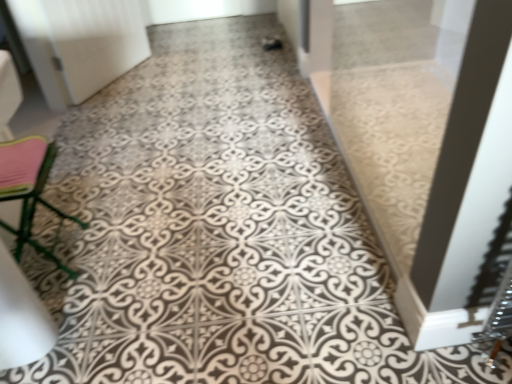
I want to click on metallic green stool at left, so click(29, 189).

This screenshot has height=384, width=512. Describe the element at coordinates (29, 189) in the screenshot. I see `metallic green stool at left` at that location.

What is the approximate height of metallic green stool at left?

The height of metallic green stool at left is 41.35 centimeters.

Measure the distance between point (32, 152) and camera.

Point (32, 152) is 4.70 feet away from camera.

Where is `metallic green stool at left`? The width and height of the screenshot is (512, 384). metallic green stool at left is located at coordinates (29, 189).